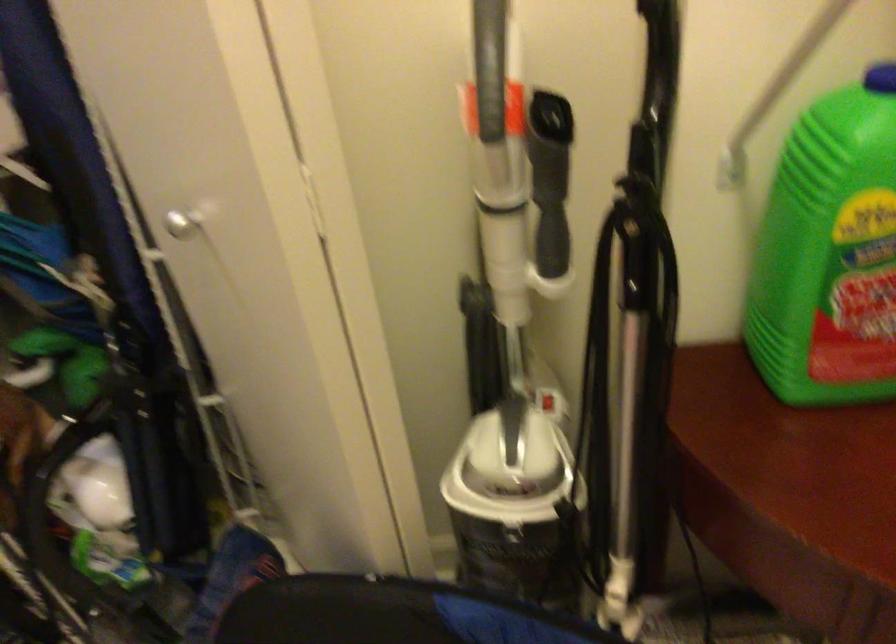
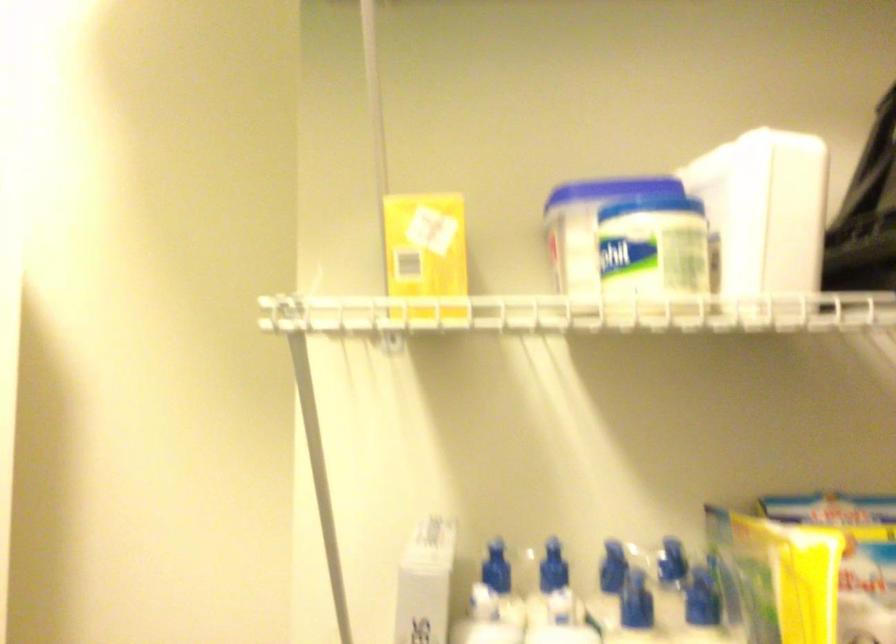
Question: The images are taken continuously from a first-person perspective. In which direction is your viewpoint rotating?

Choices:
 (A) Left
 (B) Right
 (C) Up
 (D) Down

Answer: (C)